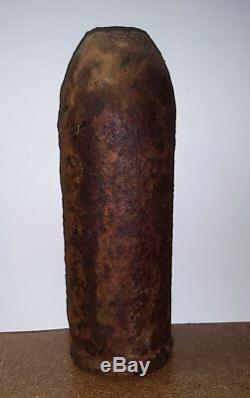
Identify the location of wall. (216, 267).